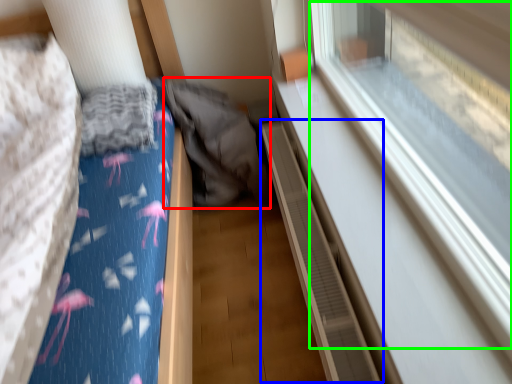
Question: Based on their relative distances, which object is farther from sleeping bag (highlighted by a red box)? Choose from balustrade (highlighted by a blue box) and train window (highlighted by a green box).

Choices:
 (A) balustrade
 (B) train window

Answer: (B)